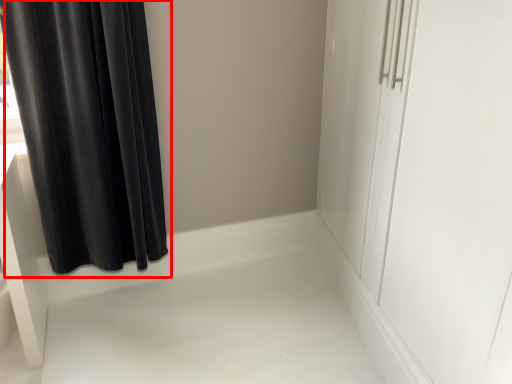
Question: From the image, what is the correct spatial relationship of curtain (annotated by the red box) in relation to screen door?

Choices:
 (A) right
 (B) left

Answer: (B)